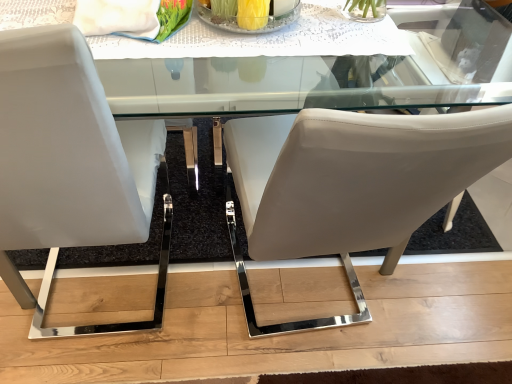
Question: From a real-world perspective, is clear glass table at upper center above or below clear glass bowl at center?

Choices:
 (A) below
 (B) above

Answer: (A)

Question: Is clear glass table at upper center inside or outside of clear glass bowl at center?

Choices:
 (A) inside
 (B) outside

Answer: (B)

Question: Estimate the real-world distances between objects in this image. Which object is closer to the clear glass bowl at center?

Choices:
 (A) white leather chair at left, the first chair when ordered from left to right
 (B) clear glass table at upper center
 (C) matte white chair at center, placed as the second chair when sorted from left to right

Answer: (C)

Question: Estimate the real-world distances between objects in this image. Which object is closer to the clear glass table at upper center?

Choices:
 (A) clear glass bowl at center
 (B) white leather chair at left, the first chair when ordered from left to right
 (C) matte white chair at center, positioned as the first chair in right-to-left order

Answer: (C)